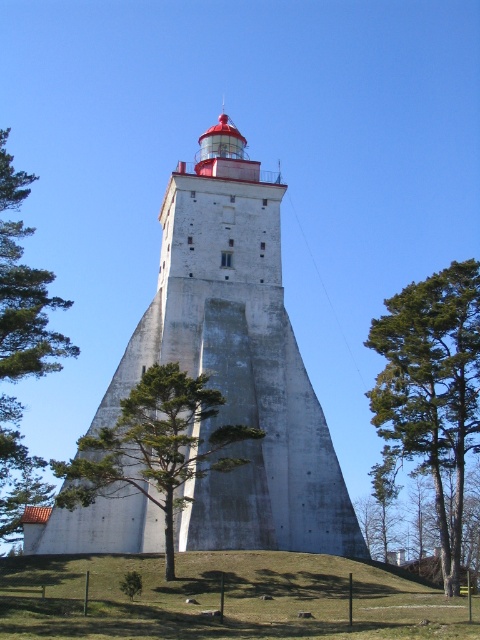
Question: Can you confirm if green grass at center is wider than green textured tree at center?

Choices:
 (A) yes
 (B) no

Answer: (A)

Question: Which object is closer to the camera taking this photo?

Choices:
 (A) green pine tree at center
 (B) green leafy tree at left
 (C) green grass at center
 (D) white concrete tower at center

Answer: (C)

Question: Which point appears closest to the camera in this image?

Choices:
 (A) (63, 340)
 (B) (364, 636)

Answer: (B)

Question: Is green pine tree at center positioned at the back of green leafy tree at left?

Choices:
 (A) no
 (B) yes

Answer: (B)

Question: Based on their relative distances, which object is nearer to the green grass at center?

Choices:
 (A) white concrete tower at center
 (B) green textured tree at center
 (C) green pine tree at center
 (D) green leafy tree at left

Answer: (B)

Question: Considering the relative positions of green pine tree at center and green leafy tree at left in the image provided, where is green pine tree at center located with respect to green leafy tree at left?

Choices:
 (A) below
 (B) above

Answer: (A)